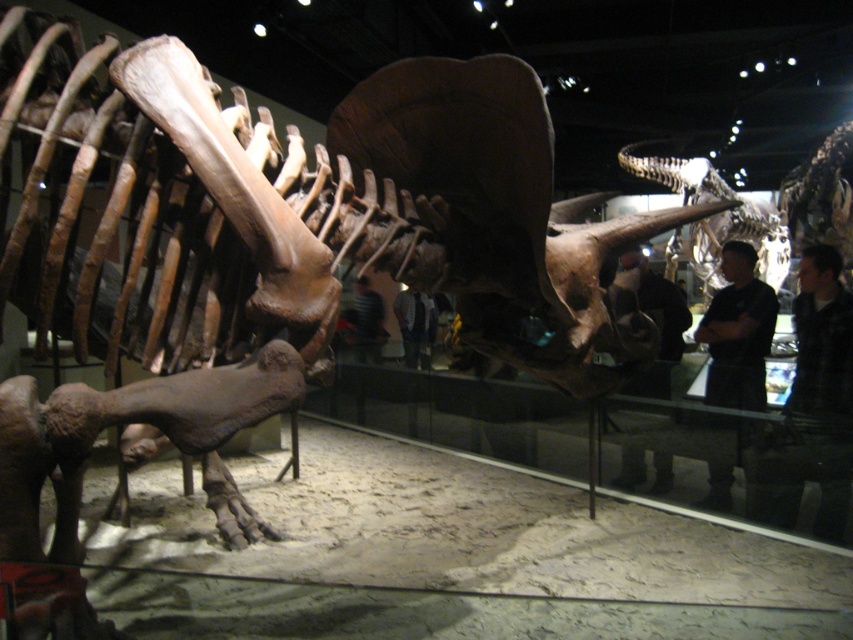
Question: Which object is positioned farthest from the brown matte skull at center?

Choices:
 (A) black shirt at right
 (B) dark blue jeans at center

Answer: (B)

Question: Among these points, which one is farthest from the camera?

Choices:
 (A) (666, 164)
 (B) (807, 365)

Answer: (A)

Question: Which object is positioned closest to the dark blue jeans at center?

Choices:
 (A) dark clothing at center
 (B) black shirt at right

Answer: (A)

Question: Does dark blue jacket at right lie behind black shirt at right?

Choices:
 (A) yes
 (B) no

Answer: (B)

Question: Considering the relative positions of dark clothing at center and striped shirt at center in the image provided, where is dark clothing at center located with respect to striped shirt at center?

Choices:
 (A) above
 (B) below

Answer: (A)

Question: Is black shirt at right smaller than striped shirt at center?

Choices:
 (A) yes
 (B) no

Answer: (B)